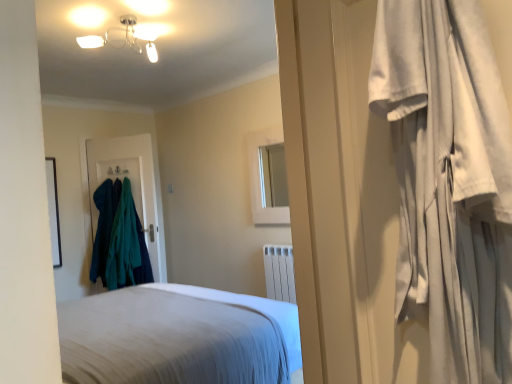
The height and width of the screenshot is (384, 512). Find the location of `free space above white glossy medicine cabinet at upper center (from a real-world perspective)`. free space above white glossy medicine cabinet at upper center (from a real-world perspective) is located at coordinates (266, 127).